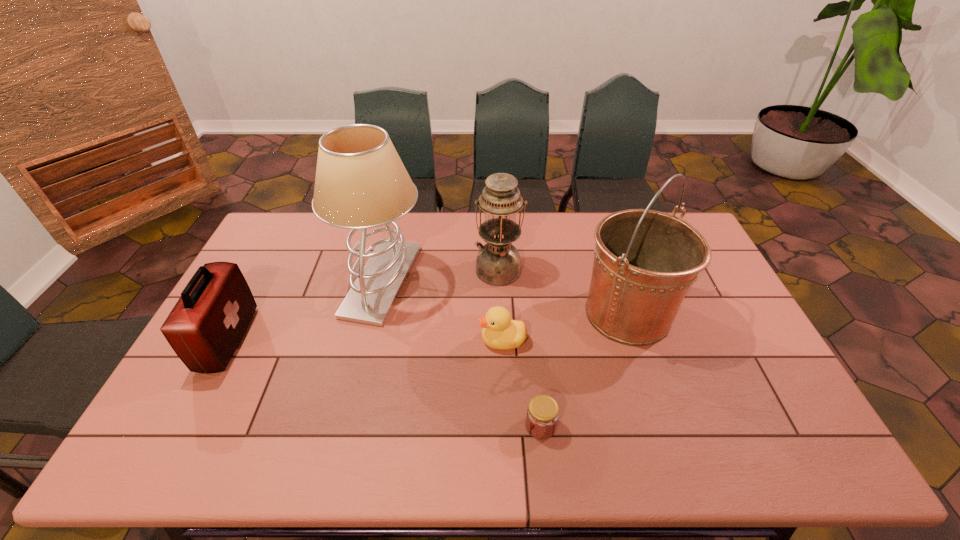
The image size is (960, 540). Identify the location of the fifth object from right to left. (361, 182).

At what (x,y) coordinates should I click in order to perform the action: click on bucket. Please return your answer as a coordinate pair (x, y). The image size is (960, 540). Looking at the image, I should click on (645, 261).

What are the coordinates of `oil lamp` in the screenshot? It's located at (498, 263).

Find the location of a particular element. The image size is (960, 540). the leftmost object is located at coordinates (206, 325).

The height and width of the screenshot is (540, 960). I want to click on the first aid kit, so click(206, 325).

You are a GUI agent. You are given a task and a screenshot of the screen. Output one action in this format:
    pyautogui.click(x=<x>, y=<y>)
    Task: Click on the duck
    The height and width of the screenshot is (540, 960).
    Given the screenshot: What is the action you would take?
    pyautogui.click(x=500, y=332)

I want to click on the nearest object, so click(x=542, y=413).

This screenshot has height=540, width=960. What are the coordinates of `the shortest object` in the screenshot? It's located at (542, 413).

Identify the location of free spot located on the left of the second object from left to right. The width and height of the screenshot is (960, 540). (244, 281).

At what (x,y) coordinates should I click in order to perform the action: click on free location located on the back of the bucket. Please return your answer as a coordinate pair (x, y). The height and width of the screenshot is (540, 960). Looking at the image, I should click on (x=601, y=231).